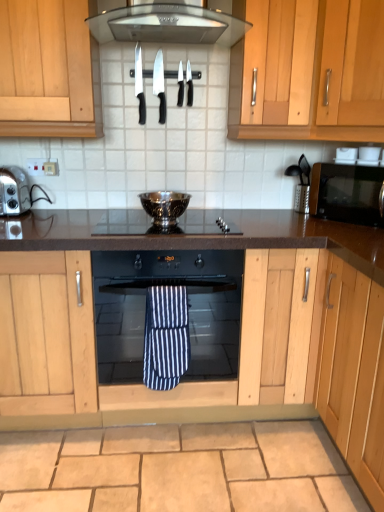
Question: Considering the relative sizes of black plastic knife at upper center, which is the fourth knife from left to right, and black glossy microwave at right in the image provided, is black plastic knife at upper center, which is the fourth knife from left to right, bigger than black glossy microwave at right?

Choices:
 (A) yes
 (B) no

Answer: (B)

Question: Is black plastic knife at upper center, marked as the 1th knife in a right-to-left arrangement, oriented away from black glossy microwave at right?

Choices:
 (A) yes
 (B) no

Answer: (B)

Question: From a real-world perspective, is black plastic knife at upper center, marked as the 1th knife in a right-to-left arrangement, physically above black glossy microwave at right?

Choices:
 (A) yes
 (B) no

Answer: (A)

Question: Does black plastic knife at upper center, which is the fourth knife from left to right, come behind black glossy microwave at right?

Choices:
 (A) no
 (B) yes

Answer: (B)

Question: From a real-world perspective, is black plastic knife at upper center, marked as the 1th knife in a right-to-left arrangement, located beneath black glossy microwave at right?

Choices:
 (A) no
 (B) yes

Answer: (A)

Question: Does point click(x=182, y=217) appear closer or farther from the camera than point click(x=178, y=78)?

Choices:
 (A) farther
 (B) closer

Answer: (A)

Question: From a real-world perspective, relative to polished stainless steel knife at center, the 2th knife in the right-to-left sequence, is polished glass gas stove at center vertically above or below?

Choices:
 (A) above
 (B) below

Answer: (B)

Question: Considering their positions, is polished glass gas stove at center located in front of or behind polished stainless steel knife at center, the 2th knife in the right-to-left sequence?

Choices:
 (A) front
 (B) behind

Answer: (A)

Question: From the image's perspective, is polished glass gas stove at center positioned above or below polished stainless steel knife at center, acting as the third knife starting from the left?

Choices:
 (A) above
 (B) below

Answer: (B)

Question: In terms of width, does metallic black coffee machine at right look wider or thinner when compared to blue striped towel at center?

Choices:
 (A) wide
 (B) thin

Answer: (A)

Question: Would you say metallic black coffee machine at right is inside or outside blue striped towel at center?

Choices:
 (A) outside
 (B) inside

Answer: (A)

Question: From their relative heights in the image, would you say metallic black coffee machine at right is taller or shorter than blue striped towel at center?

Choices:
 (A) tall
 (B) short

Answer: (B)

Question: In the image, is metallic black coffee machine at right positioned in front of or behind blue striped towel at center?

Choices:
 (A) behind
 (B) front

Answer: (A)

Question: In terms of width, does blue striped towel at center look wider or thinner when compared to black glass oven at center?

Choices:
 (A) thin
 (B) wide

Answer: (A)

Question: In terms of size, does blue striped towel at center appear bigger or smaller than black glass oven at center?

Choices:
 (A) big
 (B) small

Answer: (B)